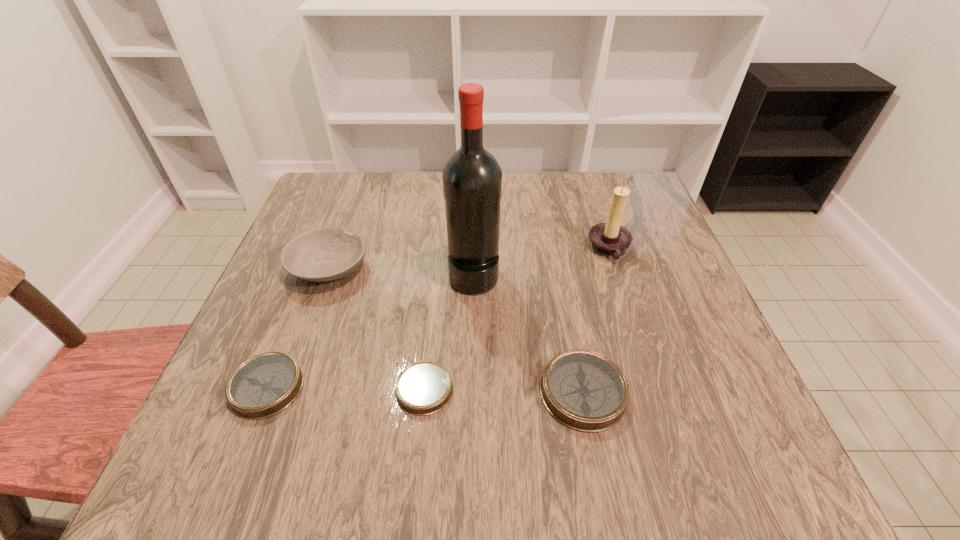
Please point a vacant point for placing a compass on the right. Please provide its 2D coordinates. Your answer should be formatted as a tuple, i.e. [(x, y)], where the tuple contains the x and y coordinates of a point satisfying the conditions above.

[(743, 395)]